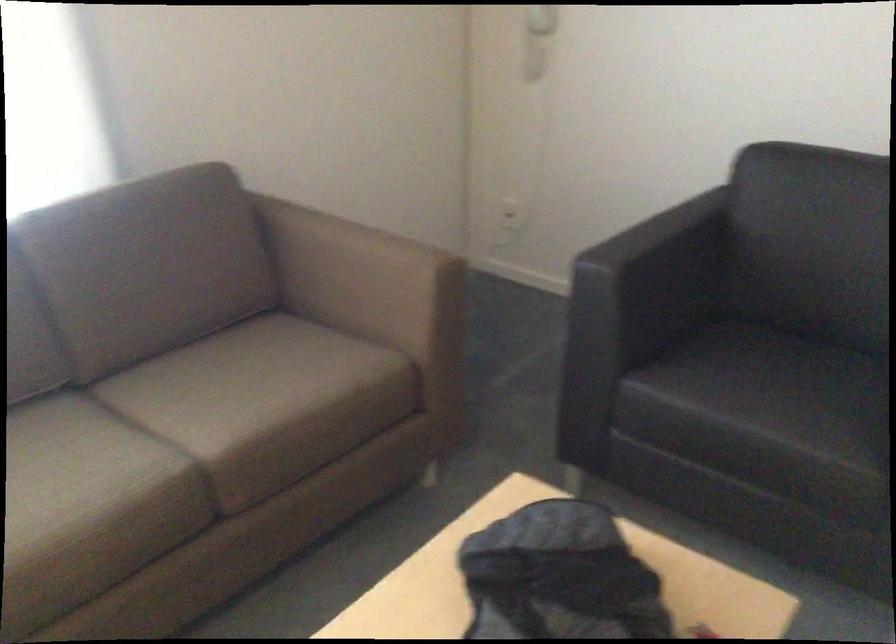
What are the coordinates of `black sofa armrest` in the screenshot? It's located at (652, 270).